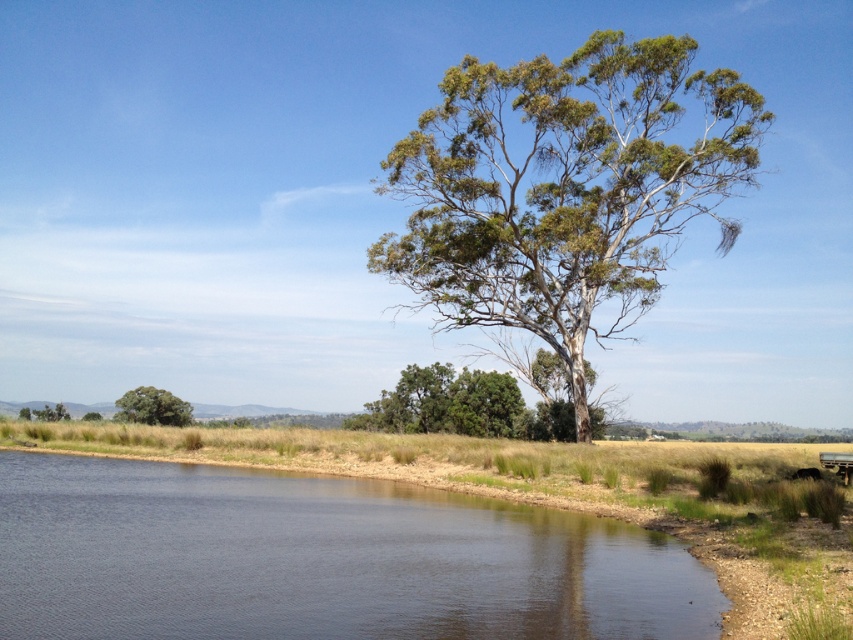
You are standing in the middle of the rural landscape and want to take a photo of both the green leafy tree at center and the green leafy tree at lower left. Which tree should you position closer to the camera to include both in the frame without one blocking the other?

To include both the green leafy tree at center and the green leafy tree at lower left in the frame without one blocking the other, you should position the green leafy tree at center closer to the camera since it is in front of the green leafy tree at lower left.

You are standing at the center of the image and want to walk towards the dark blue water at lower left and the green matte tree at lower left. Which object will you encounter first?

The dark blue water at lower left is shorter than the green matte tree at lower left, so you will encounter the dark blue water at lower left first because it is closer to you.